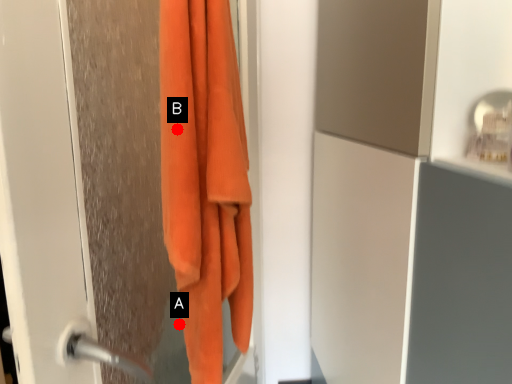
Question: Two points are circled on the image, labeled by A and B beside each circle. Among these points, which one is nearest to the camera?

Choices:
 (A) A is closer
 (B) B is closer

Answer: (B)